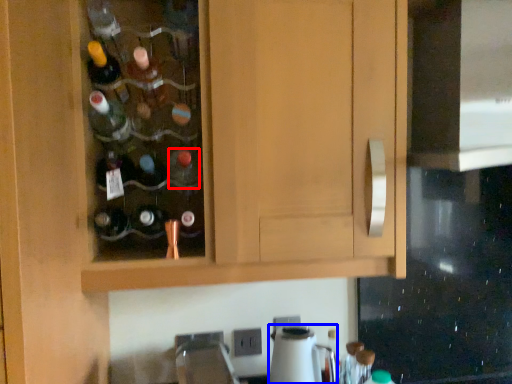
Question: Which point is further to the camera, bottle (highlighted by a red box) or appliance (highlighted by a blue box)?

Choices:
 (A) bottle
 (B) appliance

Answer: (B)